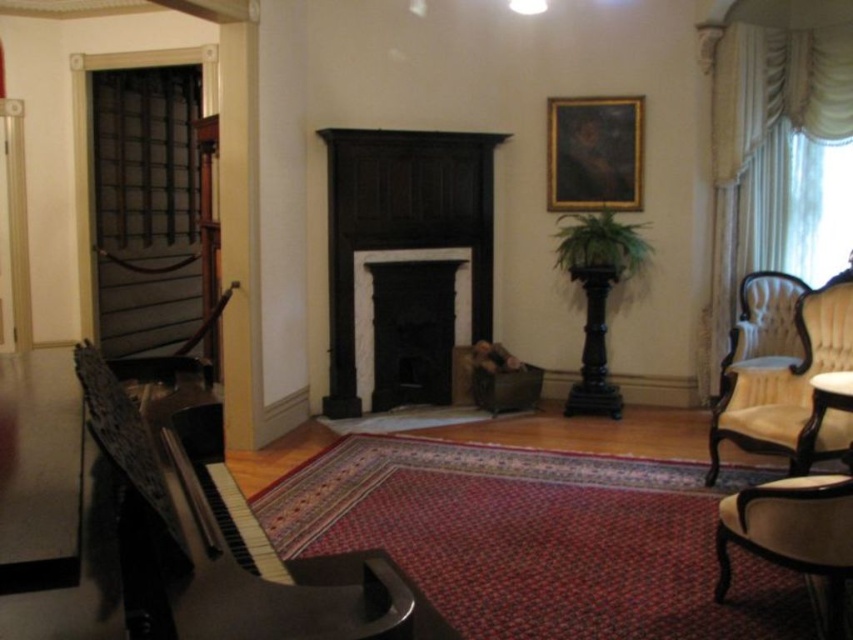
Measure the distance from black wood fireplace at center to velvet cream armchair at right.

They are 2.16 meters apart.

Which is more to the right, black wood fireplace at center or velvet cream armchair at right?

velvet cream armchair at right is more to the right.

The height and width of the screenshot is (640, 853). I want to click on black wood fireplace at center, so click(402, 221).

The image size is (853, 640). What do you see at coordinates (763, 326) in the screenshot?
I see `velvet cream armchair at right` at bounding box center [763, 326].

Is velvet cream armchair at right to the right of black matte fireplace at center from the viewer's perspective?

Correct, you'll find velvet cream armchair at right to the right of black matte fireplace at center.

Locate an element on the screen. Image resolution: width=853 pixels, height=640 pixels. velvet cream armchair at right is located at coordinates (763, 326).

Identify the location of velvet cream armchair at right. (763, 326).

Can you confirm if black wood fireplace at center is positioned to the right of black matte fireplace at center?

No, black wood fireplace at center is not to the right of black matte fireplace at center.

Does black wood fireplace at center have a larger size compared to black matte fireplace at center?

Indeed, black wood fireplace at center has a larger size compared to black matte fireplace at center.

Who is more forward, (x=367, y=129) or (x=434, y=256)?

Positioned in front is point (x=367, y=129).

This screenshot has height=640, width=853. I want to click on black wood fireplace at center, so click(402, 221).